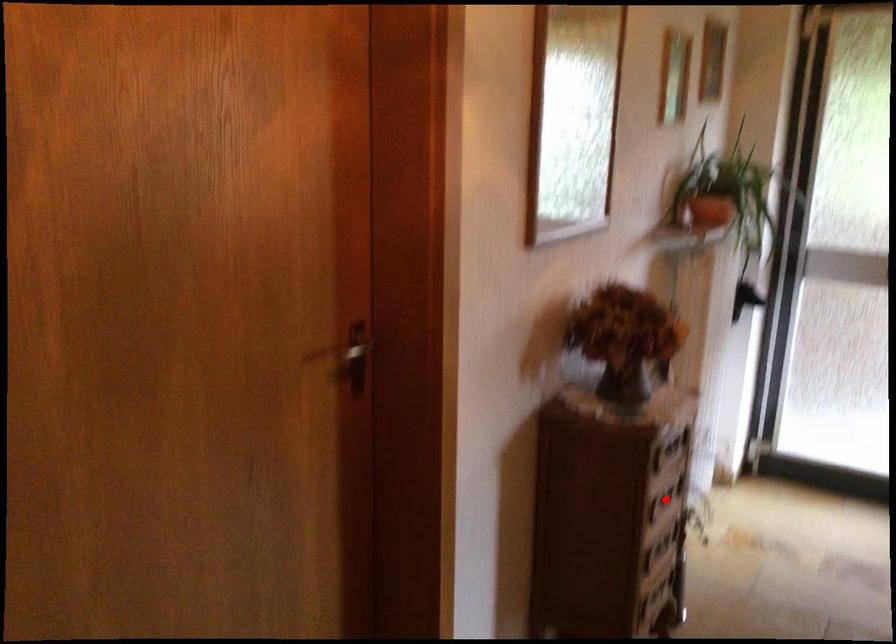
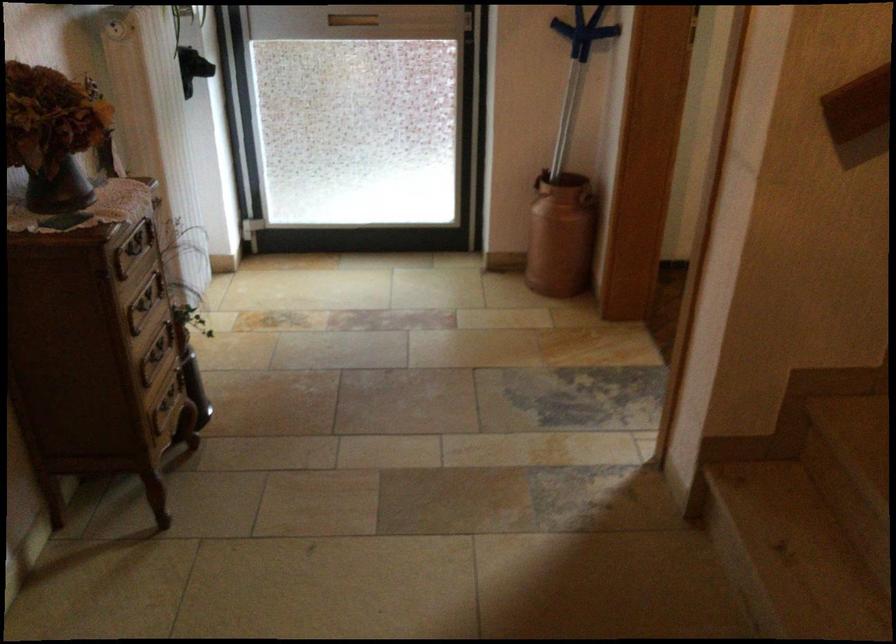
Question: I am providing you with two images of the same scene from different viewpoints. In image1, a red point is highlighted. Considering the same 3D point in image2, which of the following is correct?

Choices:
 (A) It is closer
 (B) It is farther

Answer: (A)